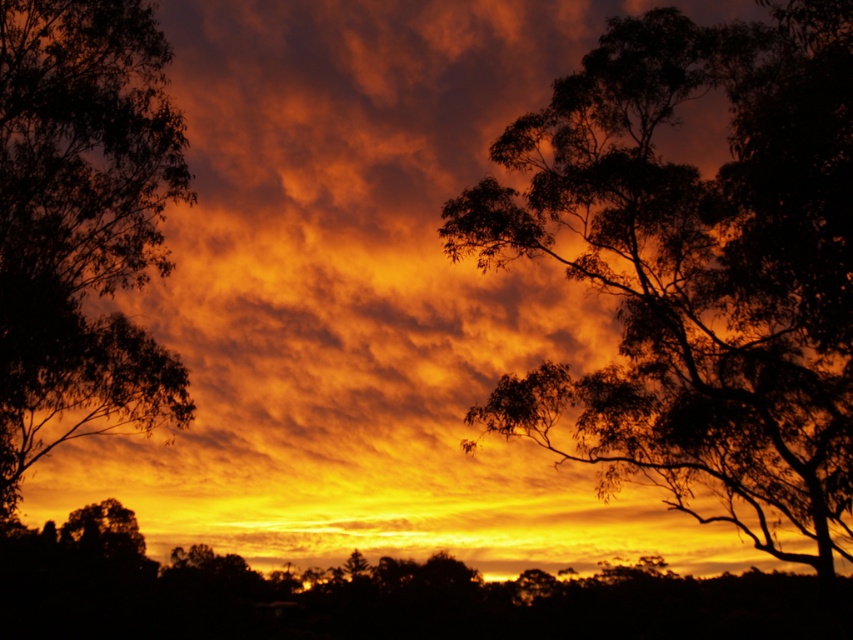
Question: Can you confirm if dark green leafy tree at center is bigger than silhouette leafy tree at left?

Choices:
 (A) no
 (B) yes

Answer: (B)

Question: Which object appears farthest from the camera in this image?

Choices:
 (A) dark green leafy tree at center
 (B) silhouette leafy tree at left

Answer: (B)

Question: Which of the following is the farthest from the observer?

Choices:
 (A) (22, 244)
 (B) (735, 369)

Answer: (B)

Question: Can you confirm if dark green leafy tree at center is positioned below silhouette leafy tree at left?

Choices:
 (A) yes
 (B) no

Answer: (A)

Question: Does dark green leafy tree at center come in front of silhouette leafy tree at left?

Choices:
 (A) yes
 (B) no

Answer: (A)

Question: Which point is closer to the camera?

Choices:
 (A) silhouette leafy tree at left
 (B) dark green leafy tree at center

Answer: (B)